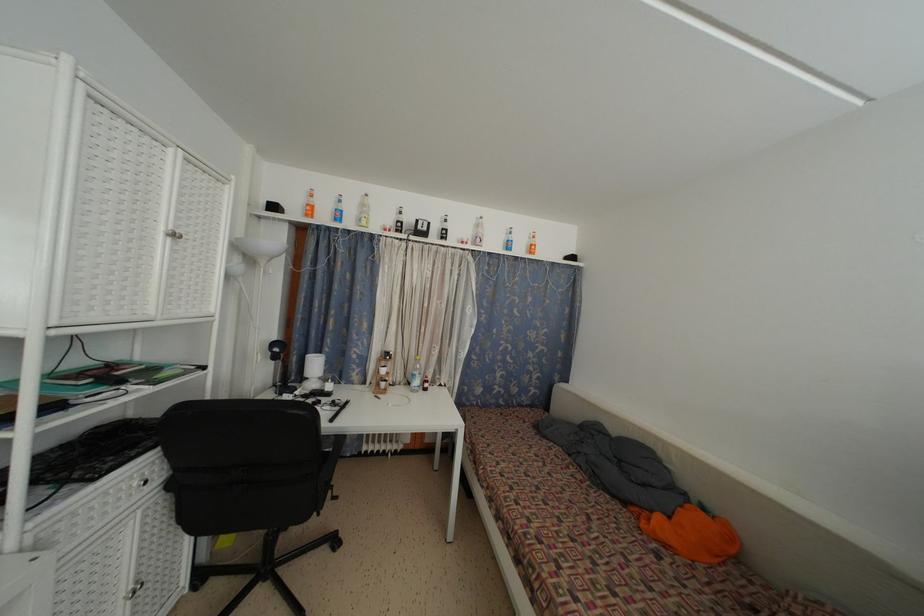
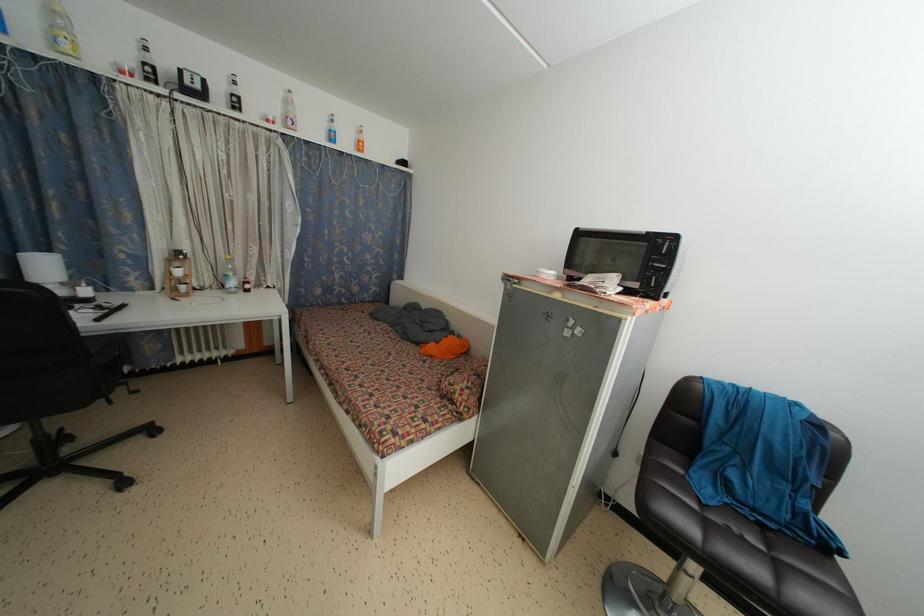
Where in the second image is the point corresponding to (x=448, y=237) from the first image?

(238, 105)